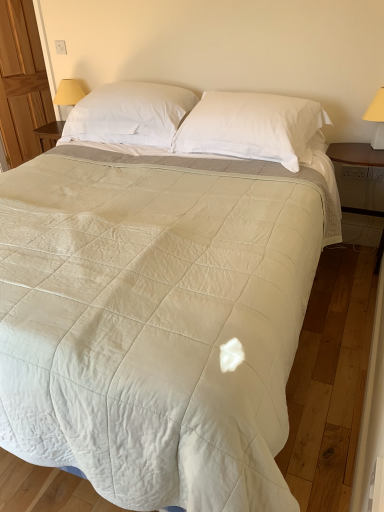
Question: Should I look upward or downward to see yellow fabric lampshade at right, which ranks as the 1th table lamp in right-to-left order?

Choices:
 (A) down
 (B) up

Answer: (B)

Question: Is yellow fabric lampshade at upper left, the 1th table lamp from the back, touching yellow fabric lampshade at right, marked as the 2th table lamp in a left-to-right arrangement?

Choices:
 (A) yes
 (B) no

Answer: (B)

Question: Does yellow fabric lampshade at upper left, the 2th table lamp in the front-to-back sequence, have a larger size compared to yellow fabric lampshade at right, which ranks as the 1th table lamp in right-to-left order?

Choices:
 (A) no
 (B) yes

Answer: (B)

Question: Does yellow fabric lampshade at upper left, which is the 2th table lamp in bottom-to-top order, contain yellow fabric lampshade at right, the first table lamp when ordered from bottom to top?

Choices:
 (A) no
 (B) yes

Answer: (A)

Question: Does yellow fabric lampshade at upper left, which is the 2th table lamp in bottom-to-top order, have a lesser height compared to yellow fabric lampshade at right, which ranks as the 1th table lamp in right-to-left order?

Choices:
 (A) yes
 (B) no

Answer: (A)

Question: Can you confirm if yellow fabric lampshade at upper left, the 2th table lamp in the front-to-back sequence, is positioned to the right of yellow fabric lampshade at right, which ranks as the 1th table lamp in right-to-left order?

Choices:
 (A) yes
 (B) no

Answer: (B)

Question: Is yellow fabric lampshade at upper left, the 1th table lamp from the back, not close to yellow fabric lampshade at right, which appears as the 2th table lamp when viewed from the top?

Choices:
 (A) no
 (B) yes

Answer: (B)

Question: From a real-world perspective, does white soft pillow at upper center, which is the first pillow from left to right, sit lower than yellow fabric lampshade at upper left, the 2th table lamp in the front-to-back sequence?

Choices:
 (A) no
 (B) yes

Answer: (A)

Question: Is white soft pillow at upper center, which is the first pillow from left to right, placed right next to yellow fabric lampshade at upper left, the first table lamp positioned from the top?

Choices:
 (A) no
 (B) yes

Answer: (A)

Question: Does white soft pillow at upper center, which is the second pillow in right-to-left order, come behind yellow fabric lampshade at upper left, the 1th table lamp from the back?

Choices:
 (A) yes
 (B) no

Answer: (B)

Question: From a real-world perspective, is white soft pillow at upper center, which is the first pillow from left to right, physically above yellow fabric lampshade at upper left, which is the second table lamp from right to left?

Choices:
 (A) yes
 (B) no

Answer: (A)

Question: Are white soft pillow at upper center, which is the first pillow from left to right, and yellow fabric lampshade at upper left, positioned as the first table lamp in left-to-right order, far apart?

Choices:
 (A) no
 (B) yes

Answer: (A)

Question: Can you confirm if white soft pillow at upper center, which is the first pillow from left to right, is thinner than yellow fabric lampshade at upper left, the 2th table lamp in the front-to-back sequence?

Choices:
 (A) no
 (B) yes

Answer: (A)

Question: Is yellow fabric lampshade at right, which appears as the 2th table lamp when viewed from the top, to the left of white soft pillow at upper center, which is the first pillow from left to right, from the viewer's perspective?

Choices:
 (A) no
 (B) yes

Answer: (A)